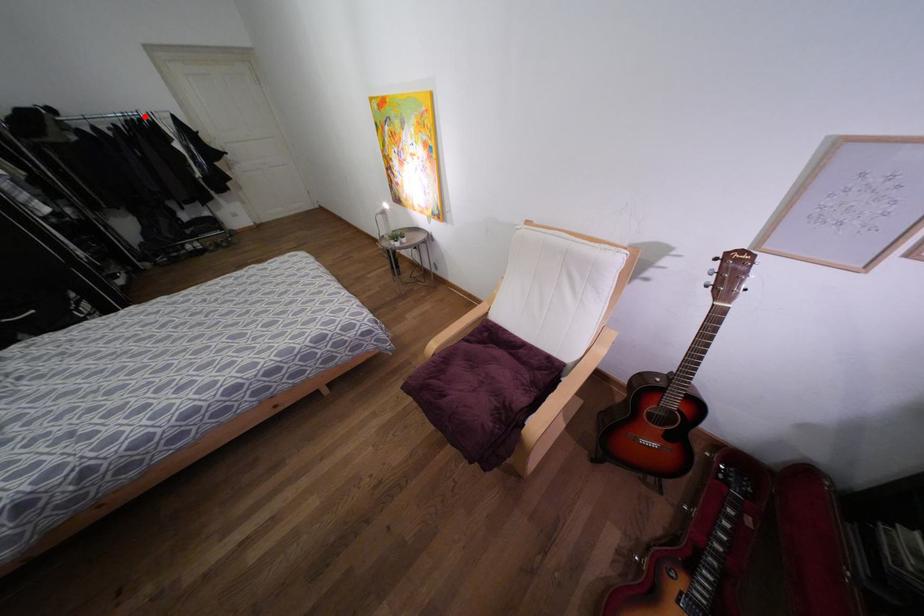
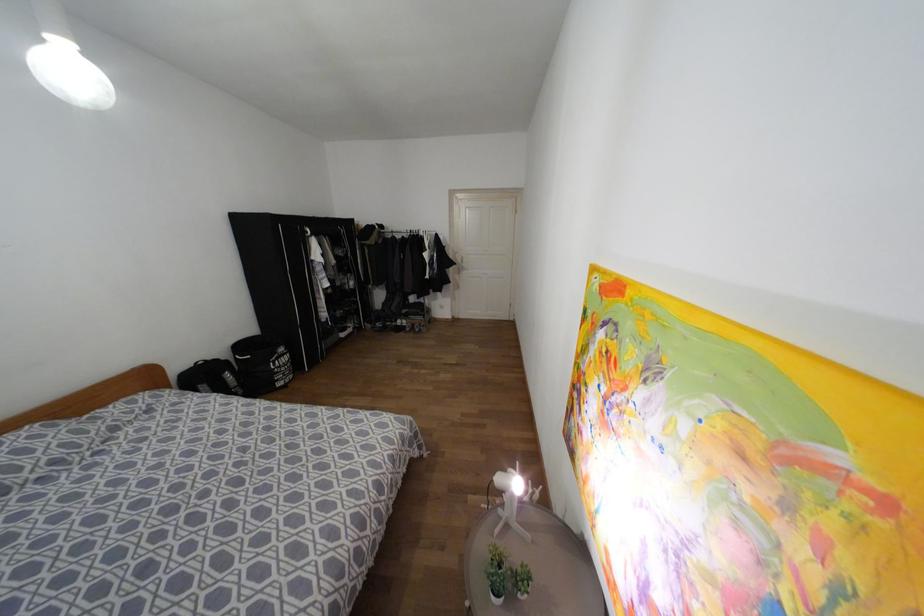
Find the pixel in the second image that matches the highlighted location in the first image.

(419, 233)